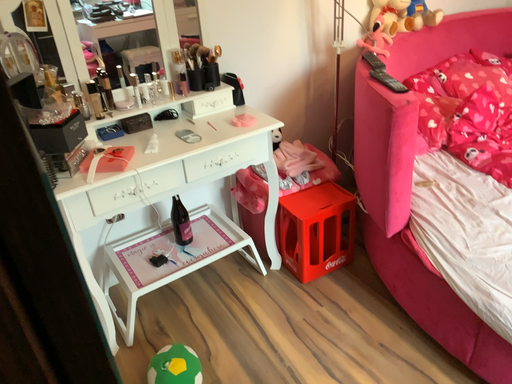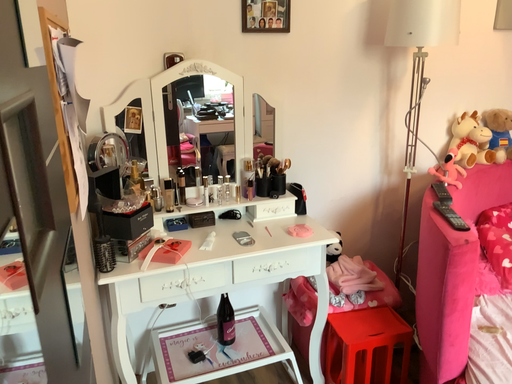
Question: Which way did the camera rotate in the video?

Choices:
 (A) rotated upward
 (B) rotated downward

Answer: (A)